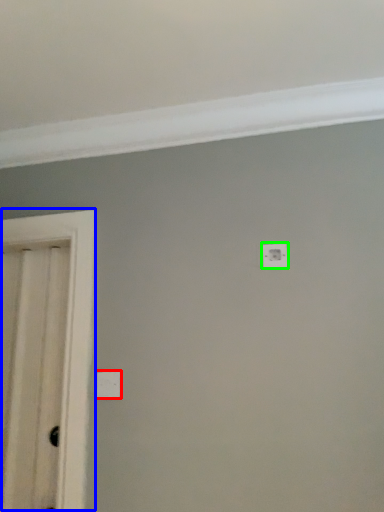
Question: Based on their relative distances, which object is farther from light switch (highlighted by a red box)? Choose from door (highlighted by a blue box) and light switch (highlighted by a green box).

Choices:
 (A) door
 (B) light switch

Answer: (B)